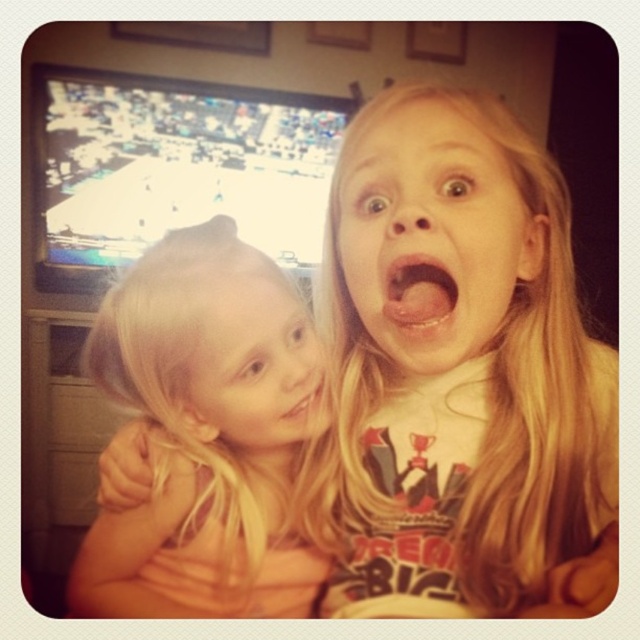
Question: Can you confirm if blonde hair at left is positioned below pink matte lips at center?

Choices:
 (A) no
 (B) yes

Answer: (B)

Question: Which object is closer to the camera taking this photo?

Choices:
 (A) smooth blonde hair at center
 (B) blonde hair at left
 (C) pink glossy lips at center
 (D) pink matte lips at center

Answer: (C)

Question: Among these points, which one is farthest from the camera?

Choices:
 (A) (266, 452)
 (B) (392, 316)
 (C) (497, 252)

Answer: (A)

Question: Observing the image, what is the correct spatial positioning of blonde hair at center in reference to pink matte lips at center?

Choices:
 (A) above
 (B) below

Answer: (A)

Question: Can you confirm if smooth blonde hair at center is thinner than pink matte lips at center?

Choices:
 (A) yes
 (B) no

Answer: (B)

Question: Among these objects, which one is nearest to the camera?

Choices:
 (A) smooth blonde hair at center
 (B) blonde hair at left

Answer: (B)